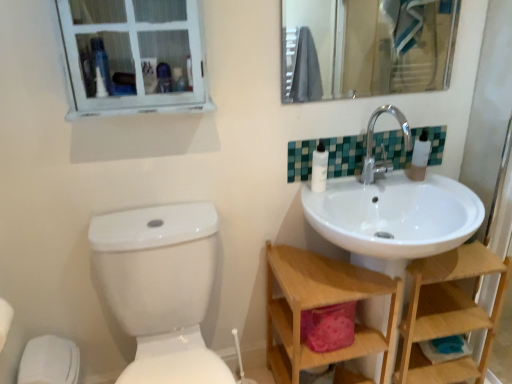
Locate an element on the screen. This screenshot has height=384, width=512. spots to the right of chrome metallic faucet at upper right is located at coordinates (432, 184).